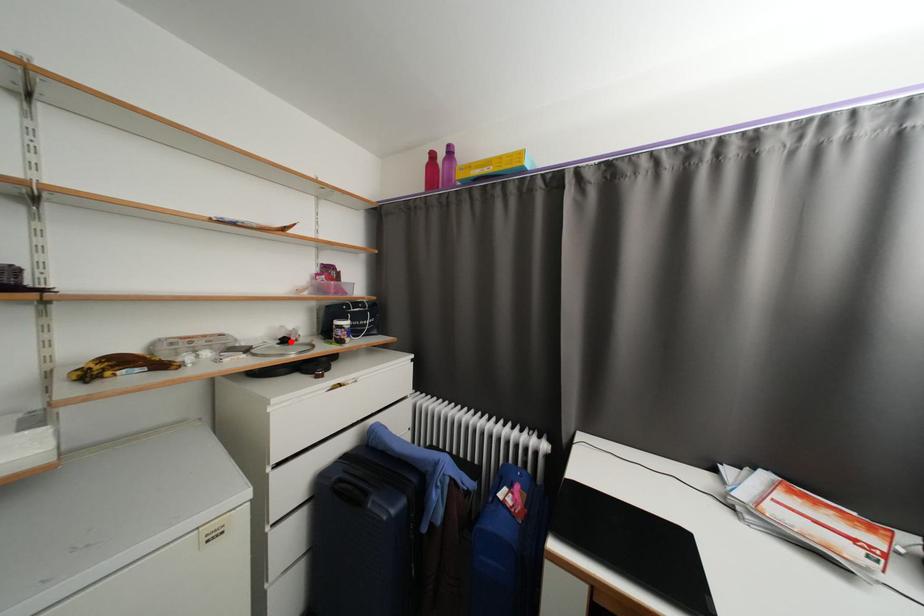
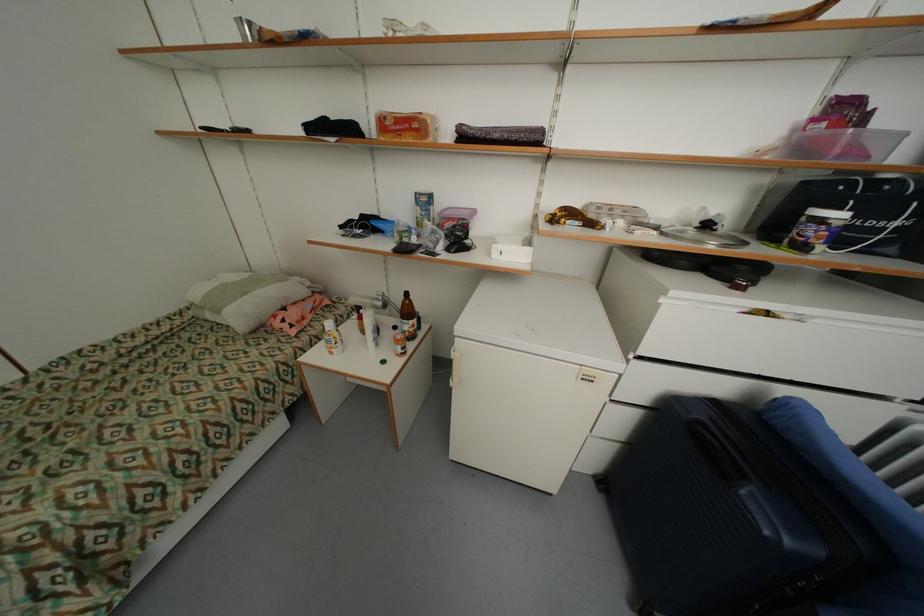
Locate, in the second image, the point that corresponds to the highlighted location in the first image.

(713, 227)